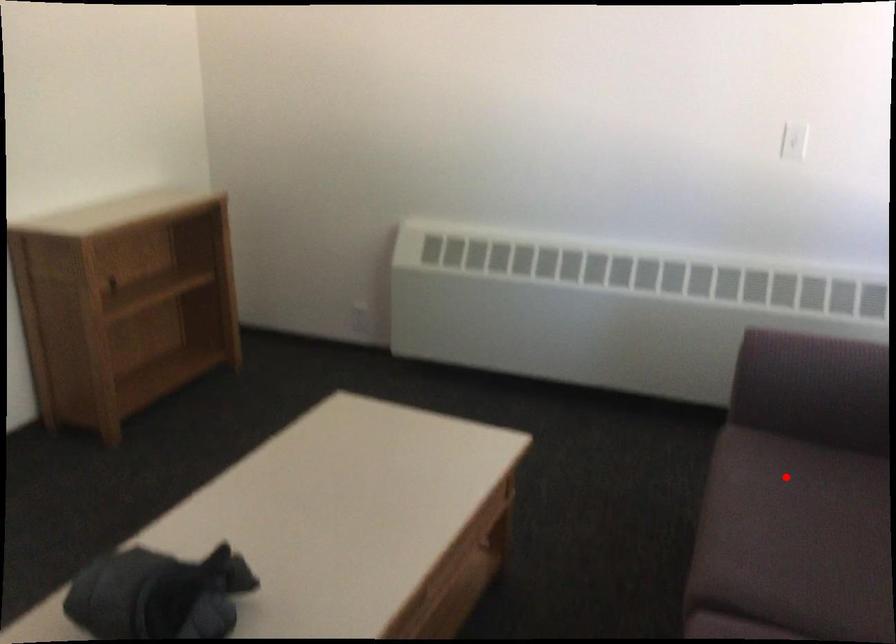
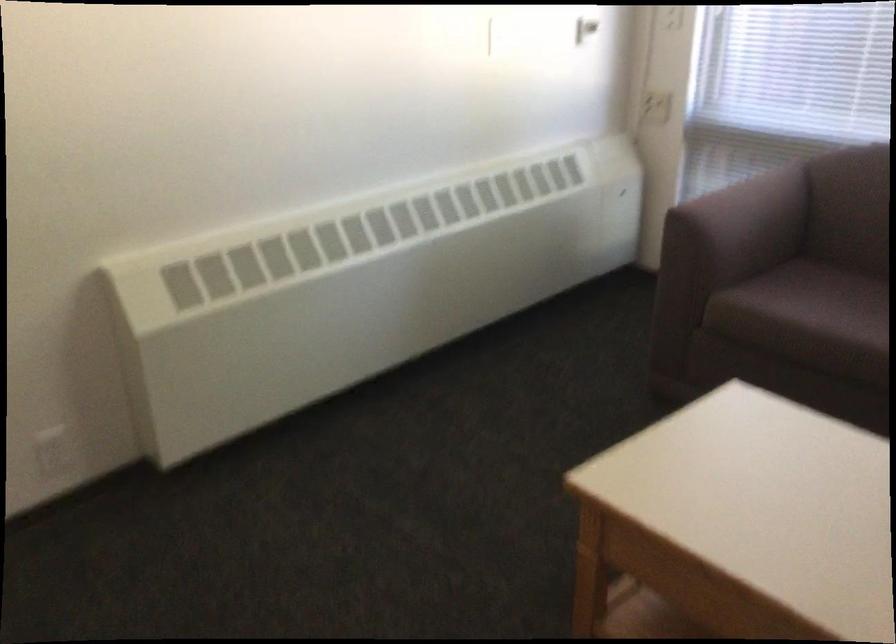
Question: A red point is marked in image1. In image2, is the corresponding 3D point closer to the camera or farther? Reply with the corresponding letter.

Choices:
 (A) The corresponding 3D point is closer.
 (B) The corresponding 3D point is farther.

Answer: (B)